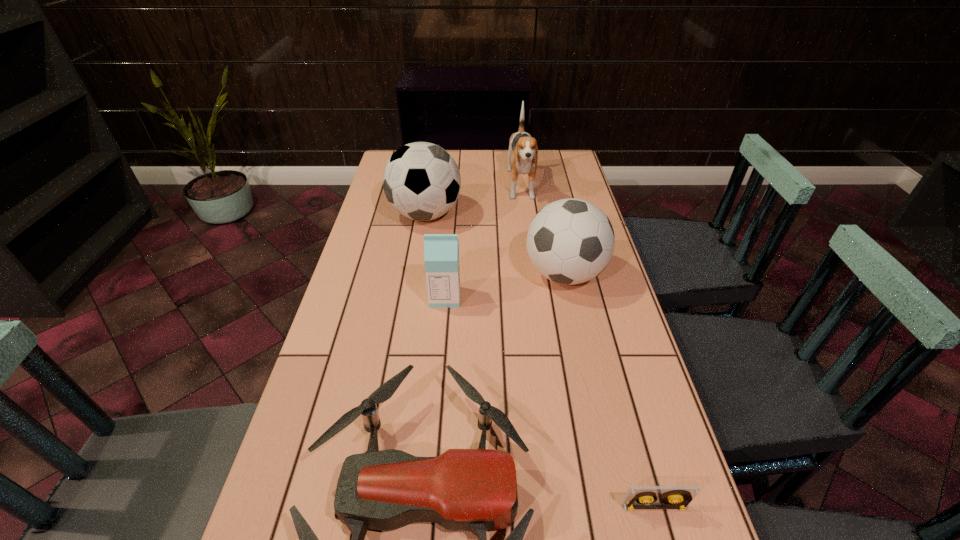
I want to click on object present at the left edge, so point(421,180).

At what (x,y) coordinates should I click in order to perform the action: click on soccer ball located at the right edge. Please return your answer as a coordinate pair (x, y). Looking at the image, I should click on coord(570,241).

At what (x,y) coordinates should I click in order to perform the action: click on videotape that is at the right edge. Please return your answer as a coordinate pair (x, y). Image resolution: width=960 pixels, height=540 pixels. Looking at the image, I should click on (637, 497).

This screenshot has height=540, width=960. I want to click on vacant space at the far edge, so click(536, 175).

At what (x,y) coordinates should I click in order to perform the action: click on free space at the left edge of the desktop. Please return your answer as a coordinate pair (x, y). The height and width of the screenshot is (540, 960). Looking at the image, I should click on (373, 200).

The image size is (960, 540). In order to click on free space at the right edge of the desktop in this screenshot , I will do (612, 304).

Identify the location of vacant space at the far right corner. (564, 157).

Identify the location of vacant point located between the milk carton and the nearer soccer ball. (505, 286).

Locate an element on the screen. free space between the puppy and the milk carton is located at coordinates (483, 242).

Find the location of a particular element. vacant area between the videotape and the farther soccer ball is located at coordinates (x=540, y=361).